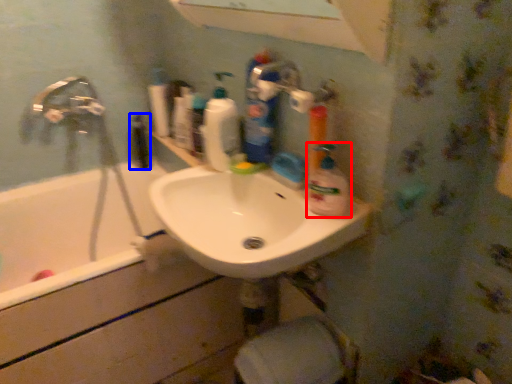
Question: Which point is further to the camera, cleaning product (highlighted by a red box) or mouthwash (highlighted by a blue box)?

Choices:
 (A) cleaning product
 (B) mouthwash

Answer: (B)